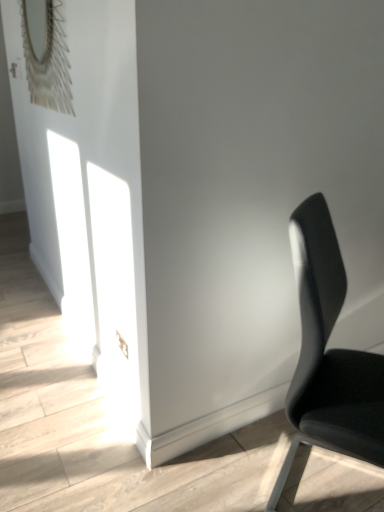
Where is `vacant region under black leather chair at right (from a real-world perspective)`? vacant region under black leather chair at right (from a real-world perspective) is located at coordinates (327, 477).